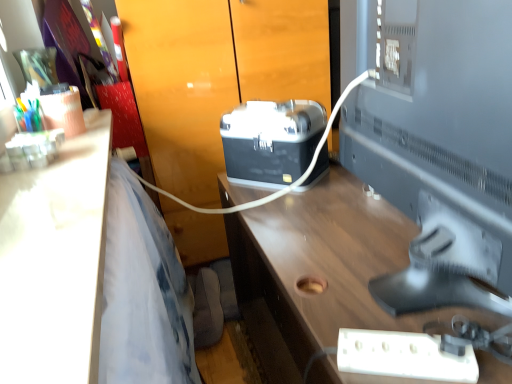
This screenshot has width=512, height=384. What do you see at coordinates (440, 149) in the screenshot? I see `satin silver monitor at right` at bounding box center [440, 149].

The height and width of the screenshot is (384, 512). What do you see at coordinates (322, 270) in the screenshot?
I see `wooden desk at center, the second desk from the left` at bounding box center [322, 270].

The height and width of the screenshot is (384, 512). I want to click on white glossy desk at left, which is the first desk from left to right, so click(55, 262).

The width and height of the screenshot is (512, 384). I want to click on black plastic projector at center, so click(271, 141).

Locate an element on the screen. The image size is (512, 384). satin silver monitor at right is located at coordinates (440, 149).

Which of these two, white glossy desk at left, which is the first desk from left to right, or wooden desk at center, the second desk from the left, is wider?

With larger width is wooden desk at center, the second desk from the left.

How different are the orientations of white glossy desk at left, the second desk viewed from the right, and wooden desk at center, the second desk from the left, in degrees?

The angular difference between white glossy desk at left, the second desk viewed from the right, and wooden desk at center, the second desk from the left, is 1.45 degrees.

Considering the relative sizes of white glossy desk at left, which is the first desk from left to right, and wooden desk at center, the second desk from the left, in the image provided, is white glossy desk at left, which is the first desk from left to right, smaller than wooden desk at center, the second desk from the left,?

Indeed, white glossy desk at left, which is the first desk from left to right, has a smaller size compared to wooden desk at center, the second desk from the left.

From a real-world perspective, who is located lower, white glossy desk at left, the second desk viewed from the right, or wooden desk at center, which is the first desk in right-to-left order?

In real-world perspective, wooden desk at center, which is the first desk in right-to-left order, is lower.

Considering the sizes of satin silver monitor at right and matte black toolbox at center in the image, is satin silver monitor at right bigger or smaller than matte black toolbox at center?

satin silver monitor at right is smaller than matte black toolbox at center.

Could you tell me if satin silver monitor at right is facing matte black toolbox at center?

No, satin silver monitor at right is not aimed at matte black toolbox at center.

Considering the points (467, 287) and (255, 66), which point is in front, point (467, 287) or point (255, 66)?

Positioned in front is point (467, 287).

Considering the relative positions of matte black toolbox at center and satin silver monitor at right in the image provided, is matte black toolbox at center to the left of satin silver monitor at right from the viewer's perspective?

Indeed, matte black toolbox at center is positioned on the left side of satin silver monitor at right.

What's the angular difference between matte black toolbox at center and satin silver monitor at right's facing directions?

The facing directions of matte black toolbox at center and satin silver monitor at right are 0.182 degrees apart.

Is matte black toolbox at center positioned behind satin silver monitor at right?

That is True.

Is white plastic extension cord at lower right placed right next to black plastic projector at center?

No, white plastic extension cord at lower right is not in contact with black plastic projector at center.

Would you say white plastic extension cord at lower right is outside black plastic projector at center?

Yes, white plastic extension cord at lower right is not within black plastic projector at center.

Does white plastic extension cord at lower right have a lesser width compared to black plastic projector at center?

Indeed, white plastic extension cord at lower right has a lesser width compared to black plastic projector at center.

From a real-world perspective, which object rests below the other?

white plastic extension cord at lower right, from a real-world perspective.

Is wooden desk at center, which is the first desk in right-to-left order, facing towards white plastic extension cord at lower right?

No.

Measure the distance between wooden desk at center, the second desk from the left, and white plastic extension cord at lower right.

The distance of wooden desk at center, the second desk from the left, from white plastic extension cord at lower right is 17.43 inches.

From the image's perspective, who appears lower, wooden desk at center, which is the first desk in right-to-left order, or white plastic extension cord at lower right?

wooden desk at center, which is the first desk in right-to-left order.

Is there a large distance between wooden desk at center, which is the first desk in right-to-left order, and white plastic extension cord at lower right?

wooden desk at center, which is the first desk in right-to-left order, is actually quite close to white plastic extension cord at lower right.

Which is further, (269, 169) or (75, 271)?

The point (269, 169) is behind.

Find the location of a particular element. This screenshot has width=512, height=384. desk that is the 1st one when counting downward from the black plastic projector at center (from the image's perspective) is located at coordinates (55, 262).

Which is more to the left, black plastic projector at center or white glossy desk at left, the second desk viewed from the right?

white glossy desk at left, the second desk viewed from the right.

Between black plastic projector at center and white glossy desk at left, which is the first desk from left to right, which one has less height?

Standing shorter between the two is white glossy desk at left, which is the first desk from left to right.

This screenshot has width=512, height=384. I want to click on the 1st desk positioned below the matte black toolbox at center (from the image's perspective), so click(55, 262).

Can you confirm if white glossy desk at left, which is the first desk from left to right, is smaller than matte black toolbox at center?

Indeed, white glossy desk at left, which is the first desk from left to right, has a smaller size compared to matte black toolbox at center.

From a real-world perspective, relative to matte black toolbox at center, is white glossy desk at left, the second desk viewed from the right, vertically above or below?

In terms of real-world spatial position, white glossy desk at left, the second desk viewed from the right, is above matte black toolbox at center.

Considering their positions, is white glossy desk at left, the second desk viewed from the right, located in front of or behind matte black toolbox at center?

white glossy desk at left, the second desk viewed from the right, is in front of matte black toolbox at center.

In the image, there is a white glossy desk at left, the second desk viewed from the right. Where is `desk below it (from a real-world perspective)`? The width and height of the screenshot is (512, 384). desk below it (from a real-world perspective) is located at coordinates (322, 270).

Where is `dresser located behind the satin silver monitor at right`? dresser located behind the satin silver monitor at right is located at coordinates (216, 75).

When comparing their distances from white plastic extension cord at lower right, does black plastic projector at center or white glossy desk at left, which is the first desk from left to right, seem closer?

white glossy desk at left, which is the first desk from left to right, lies closer to white plastic extension cord at lower right than the other object.

From the image, which object appears to be nearer to black plastic projector at center, matte black toolbox at center or satin silver monitor at right?

Based on the image, satin silver monitor at right appears to be nearer to black plastic projector at center.

When comparing their distances from black plastic projector at center, does matte black toolbox at center or wooden desk at center, which is the first desk in right-to-left order, seem further?

matte black toolbox at center is further to black plastic projector at center.

Which object lies nearer to the anchor point black plastic projector at center, matte black toolbox at center or white glossy desk at left, the second desk viewed from the right?

Based on the image, matte black toolbox at center appears to be nearer to black plastic projector at center.

From the image, which object appears to be farther from satin silver monitor at right, black plastic projector at center or wooden desk at center, which is the first desk in right-to-left order?

black plastic projector at center is positioned further to the anchor satin silver monitor at right.

Looking at the image, which one is located closer to white glossy desk at left, the second desk viewed from the right, white plastic extension cord at lower right or satin silver monitor at right?

white plastic extension cord at lower right is closer to white glossy desk at left, the second desk viewed from the right.

When comparing their distances from black plastic projector at center, does satin silver monitor at right or matte black toolbox at center seem further?

The object further to black plastic projector at center is matte black toolbox at center.

When comparing their distances from white glossy desk at left, which is the first desk from left to right, does black plastic projector at center or matte black toolbox at center seem closer?

Among the two, black plastic projector at center is located nearer to white glossy desk at left, which is the first desk from left to right.

Locate an element on the screen. The height and width of the screenshot is (384, 512). appliance between wooden desk at center, which is the first desk in right-to-left order, and matte black toolbox at center, along the z-axis is located at coordinates (271, 141).

Locate an element on the screen. The width and height of the screenshot is (512, 384). desktop computer between white plastic extension cord at lower right and matte black toolbox at center from front to back is located at coordinates (440, 149).

Where is `appliance between white glossy desk at left, which is the first desk from left to right, and satin silver monitor at right, in the horizontal direction`? The width and height of the screenshot is (512, 384). appliance between white glossy desk at left, which is the first desk from left to right, and satin silver monitor at right, in the horizontal direction is located at coordinates (271, 141).

Where is `desktop computer between wooden desk at center, the second desk from the left, and matte black toolbox at center from front to back`? Image resolution: width=512 pixels, height=384 pixels. desktop computer between wooden desk at center, the second desk from the left, and matte black toolbox at center from front to back is located at coordinates (440, 149).